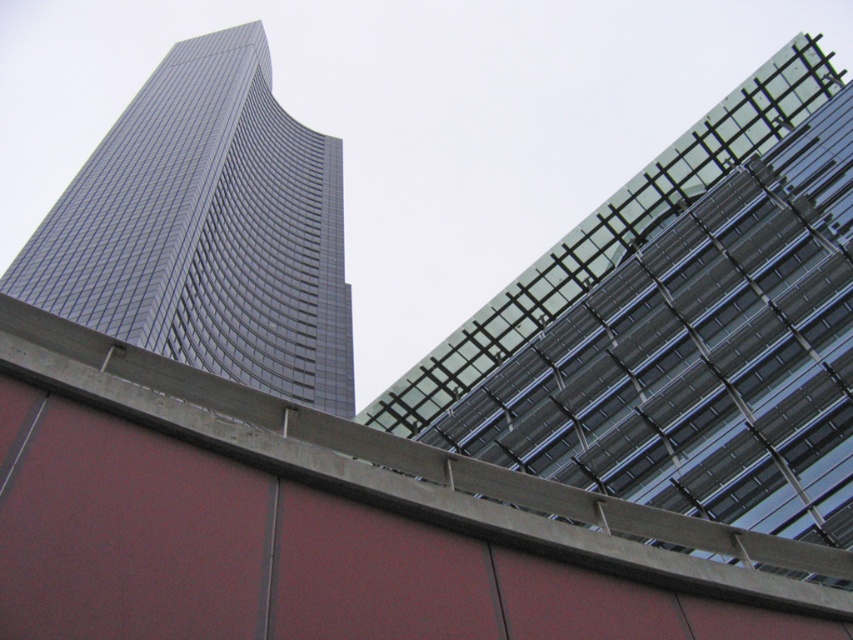
You are standing at the point indicated by point (x=682, y=326) in the image. Which building are you facing? The tall skyscraper on the left or the angular glass building on the right?

The point (x=682, y=326) indicates transparent glass building at upper right, so you are facing the angular glass building on the right.

From the picture: You are an urban planner reviewing this architectural design. You need to determine the spatial relationship between the transparent glass building at upper right and the shiny glass skyscraper at left. Which building is located to the right of the other?

The transparent glass building at upper right is positioned on the right side of the shiny glass skyscraper at left.